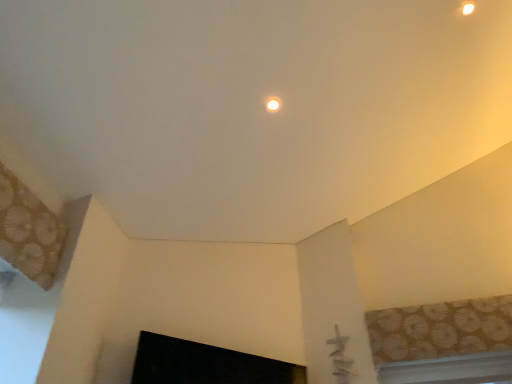
Question: Based on their sizes in the image, would you say matte white light fixture at upper center is bigger or smaller than white plastic window at lower right, which ranks as the first window in bottom-to-top order?

Choices:
 (A) small
 (B) big

Answer: (A)

Question: From their relative heights in the image, would you say matte white light fixture at upper center is taller or shorter than white plastic window at lower right, which ranks as the first window in bottom-to-top order?

Choices:
 (A) short
 (B) tall

Answer: (B)

Question: Considering the real-world distances, which object is closest to the patterned fabric window at upper right, which is counted as the second window, starting from the bottom?

Choices:
 (A) white plastic window at lower right, marked as the second window in a top-to-bottom arrangement
 (B) matte white light fixture at upper center
 (C) black glossy fireplace at lower center

Answer: (A)

Question: Which of these objects is positioned closest to the white plastic window at lower right, marked as the second window in a top-to-bottom arrangement?

Choices:
 (A) matte white light fixture at upper center
 (B) patterned fabric window at upper right, which is counted as the second window, starting from the bottom
 (C) black glossy fireplace at lower center

Answer: (B)